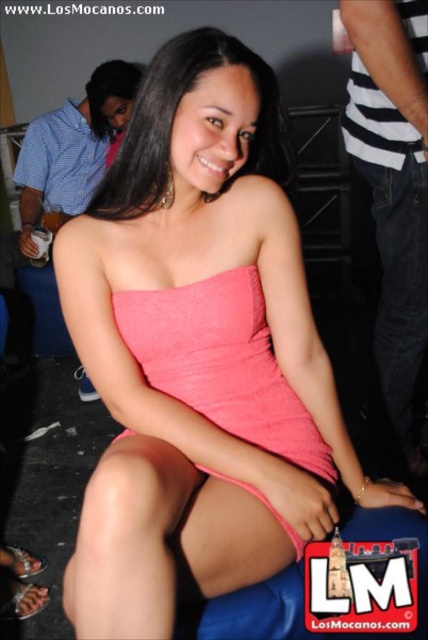
This screenshot has height=640, width=428. Describe the element at coordinates (394, 186) in the screenshot. I see `denim shorts at right` at that location.

Who is more distant from viewer, (425,65) or (329,461)?

Point (425,65)

Image resolution: width=428 pixels, height=640 pixels. What are the coordinates of `denim shorts at right` in the screenshot? It's located at (394, 186).